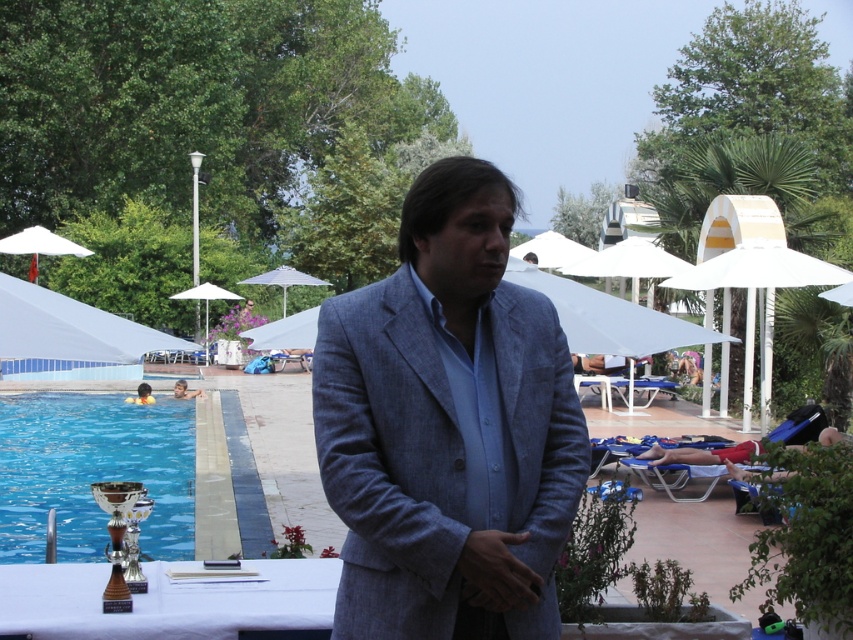
Who is higher up, light blue textured suit at center or blue glass trophy at lower left?

light blue textured suit at center is above.

Who is more distant from viewer, (538,420) or (103,532)?

Positioned behind is point (103,532).

In order to click on light blue textured suit at center in this screenshot , I will do `click(448, 428)`.

Consider the image. Can you confirm if light blue textured suit at center is bigger than white fabric umbrella at upper center?

No.

Who is positioned more to the right, light blue textured suit at center or white fabric umbrella at upper center?

Positioned to the right is light blue textured suit at center.

Locate an element on the screen. The image size is (853, 640). light blue textured suit at center is located at coordinates (x=448, y=428).

Find the location of a particular element. This screenshot has width=853, height=640. light blue textured suit at center is located at coordinates (448, 428).

Can you confirm if white fabric umbrella at upper left is taller than white fabric umbrella at upper center?

Correct, white fabric umbrella at upper left is much taller as white fabric umbrella at upper center.

Between white fabric umbrella at upper left and white fabric umbrella at upper center, which one appears on the right side from the viewer's perspective?

white fabric umbrella at upper center

Locate an element on the screen. white fabric umbrella at upper left is located at coordinates (39, 246).

The width and height of the screenshot is (853, 640). In order to click on white fabric umbrella at upper left in this screenshot , I will do `click(39, 246)`.